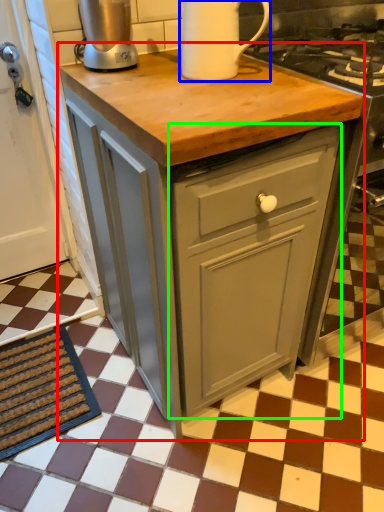
Question: Which is farther away from table (highlighted by a red box)? kitchen appliance (highlighted by a blue box) or cabinetry (highlighted by a green box)?

Choices:
 (A) kitchen appliance
 (B) cabinetry

Answer: (A)